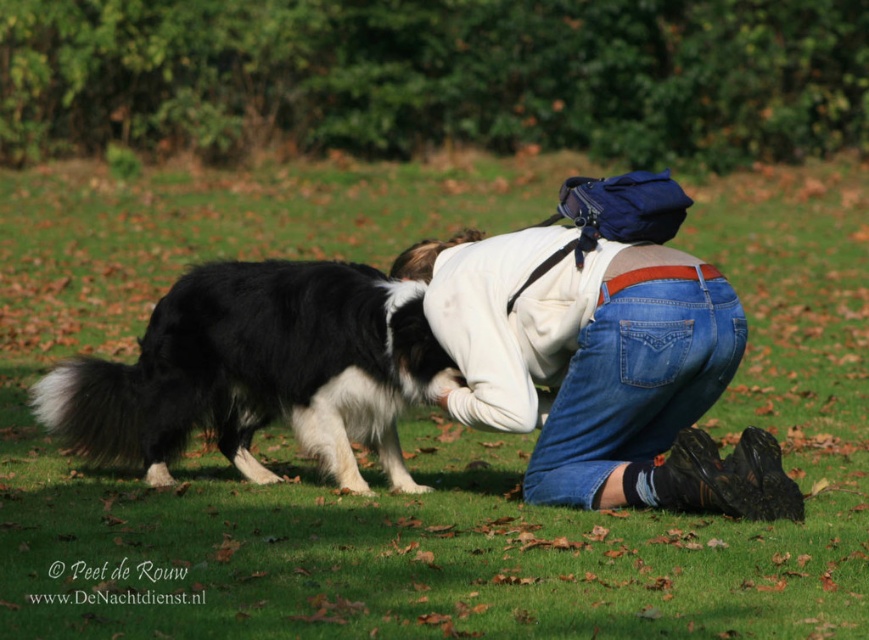
Is denim jeans at center thinner than black and white fur at lower left?

Yes.

Is denim jeans at center in front of black and white fur at lower left?

Yes.

Does point (587, 262) come in front of point (111, 372)?

Yes, it is.

Locate an element on the screen. The image size is (869, 640). denim jeans at center is located at coordinates (601, 374).